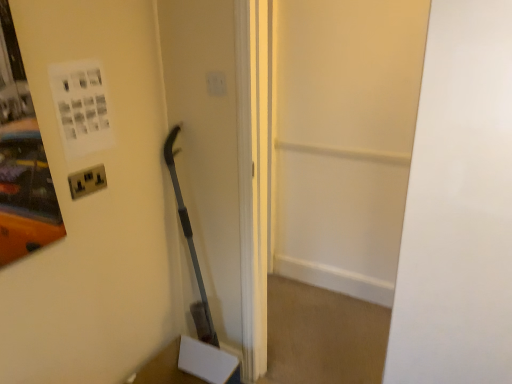
Image resolution: width=512 pixels, height=384 pixels. What do you see at coordinates (216, 83) in the screenshot?
I see `white plastic light switch at upper center` at bounding box center [216, 83].

In order to face metallic socket at left, should I rotate leftwards or rightwards?

You should rotate left by 21.430 degrees.

Measure the distance between point (391, 13) and camera.

Point (391, 13) is 6.91 feet away from camera.

The height and width of the screenshot is (384, 512). Find the location of `white matte door at center`. white matte door at center is located at coordinates (458, 206).

Is white plastic light switch at upper center positioned far away from metallic socket at left?

No, white plastic light switch at upper center is not far from metallic socket at left.

Is metallic socket at left at the back of white plastic light switch at upper center?

white plastic light switch at upper center is not turned away from metallic socket at left.

Considering the points (210, 77) and (97, 168), which point is in front, point (210, 77) or point (97, 168)?

The point (97, 168) is closer to the camera.

In the scene shown: From the image's perspective, which is below, white plastic light switch at upper center or metallic socket at left?

metallic socket at left, from the image's perspective.

Which object is further away from the camera taking this photo, white matte door at center or white plastic light switch at upper center?

Positioned behind is white plastic light switch at upper center.

Would you say white matte door at center is a long distance from white plastic light switch at upper center?

Yes, white matte door at center is far from white plastic light switch at upper center.

Is white matte door at center positioned beyond the bounds of white plastic light switch at upper center?

Yes.

Is white matte door at center positioned with its back to white plastic light switch at upper center?

No, white matte door at center's orientation is not away from white plastic light switch at upper center.

Which is in front, white matte door at center or transparent glass door at center?

white matte door at center is in front.

Who is bigger, white matte door at center or transparent glass door at center?

white matte door at center.

Find the location of a particular element. The image size is (512, 384). door that is above the transparent glass door at center (from a real-world perspective) is located at coordinates (458, 206).

Does white matte door at center have a lesser height compared to transparent glass door at center?

Yes, white matte door at center is shorter than transparent glass door at center.

From a real-world perspective, is transparent glass door at center beneath white plastic light switch at upper center?

Yes, from a real-world perspective, transparent glass door at center is below white plastic light switch at upper center.

From the image's perspective, is transparent glass door at center positioned above or below white plastic light switch at upper center?

From the image's perspective, transparent glass door at center appears below white plastic light switch at upper center.

Are transparent glass door at center and white plastic light switch at upper center located far from each other?

Yes, transparent glass door at center and white plastic light switch at upper center are located far from each other.

Is transparent glass door at center to the right of white plastic light switch at upper center from the viewer's perspective?

Correct, you'll find transparent glass door at center to the right of white plastic light switch at upper center.

Which point is more distant from viewer, (394, 33) or (430, 34)?

The point (394, 33) is behind.

Is transparent glass door at center inside the boundaries of white matte door at center, or outside?

transparent glass door at center is spatially situated outside white matte door at center.

From the image's perspective, is transparent glass door at center above white matte door at center?

Yes, from the image's perspective, transparent glass door at center is on top of white matte door at center.

Measure the distance between transparent glass door at center and white matte door at center.

A distance of 1.71 meters exists between transparent glass door at center and white matte door at center.

Is white plastic light switch at upper center placed right next to white matte door at center?

They are not placed beside each other.

In terms of width, does white plastic light switch at upper center look wider or thinner when compared to white matte door at center?

Clearly, white plastic light switch at upper center has less width compared to white matte door at center.

Which is correct: white plastic light switch at upper center is inside white matte door at center, or outside of it?

white plastic light switch at upper center is outside white matte door at center.

The width and height of the screenshot is (512, 384). I want to click on electric outlet located underneath the white plastic light switch at upper center (from a real-world perspective), so click(x=87, y=181).

Is metallic socket at left at the left side of white plastic light switch at upper center?

Correct, you'll find metallic socket at left to the left of white plastic light switch at upper center.

Consider the image. Which object is thinner, metallic socket at left or white plastic light switch at upper center?

Thinner between the two is white plastic light switch at upper center.

From the image's perspective, is metallic socket at left located above white plastic light switch at upper center?

Incorrect, from the image's perspective, metallic socket at left is lower than white plastic light switch at upper center.

Where is `light switch that is above the metallic socket at left (from a real-world perspective)`? Image resolution: width=512 pixels, height=384 pixels. light switch that is above the metallic socket at left (from a real-world perspective) is located at coordinates (216, 83).

Identify the location of light switch that is on the left side of white matte door at center. Image resolution: width=512 pixels, height=384 pixels. (216, 83).

Which object lies nearer to the anchor point white plastic light switch at upper center, transparent glass door at center or metallic socket at left?

Among the two, metallic socket at left is located nearer to white plastic light switch at upper center.

Estimate the real-world distances between objects in this image. Which object is closer to white matte door at center, transparent glass door at center or metallic socket at left?

Based on the image, metallic socket at left appears to be nearer to white matte door at center.

When comparing their distances from white plastic light switch at upper center, does transparent glass door at center or white matte door at center seem closer?

white matte door at center.

Considering their positions, is white matte door at center positioned closer to white plastic light switch at upper center than metallic socket at left?

Based on the image, metallic socket at left appears to be nearer to white plastic light switch at upper center.

Estimate the real-world distances between objects in this image. Which object is closer to metallic socket at left, white plastic light switch at upper center or transparent glass door at center?

white plastic light switch at upper center is positioned closer to the anchor metallic socket at left.

When comparing their distances from white plastic light switch at upper center, does white matte door at center or transparent glass door at center seem further?

transparent glass door at center is further to white plastic light switch at upper center.

Estimate the real-world distances between objects in this image. Which object is further from metallic socket at left, white matte door at center or transparent glass door at center?

transparent glass door at center is further to metallic socket at left.

Which object lies further to the anchor point transparent glass door at center, metallic socket at left or white plastic light switch at upper center?

metallic socket at left is positioned further to the anchor transparent glass door at center.

Where is `glass door between metallic socket at left and white matte door at center from left to right`? glass door between metallic socket at left and white matte door at center from left to right is located at coordinates (341, 138).

Where is `electric outlet between white matte door at center and white plastic light switch at upper center along the z-axis`? The height and width of the screenshot is (384, 512). electric outlet between white matte door at center and white plastic light switch at upper center along the z-axis is located at coordinates (87, 181).

Find the location of a particular element. This screenshot has height=384, width=512. light switch situated between metallic socket at left and transparent glass door at center from left to right is located at coordinates (216, 83).

The width and height of the screenshot is (512, 384). I want to click on glass door positioned between white matte door at center and white plastic light switch at upper center from near to far, so (341, 138).